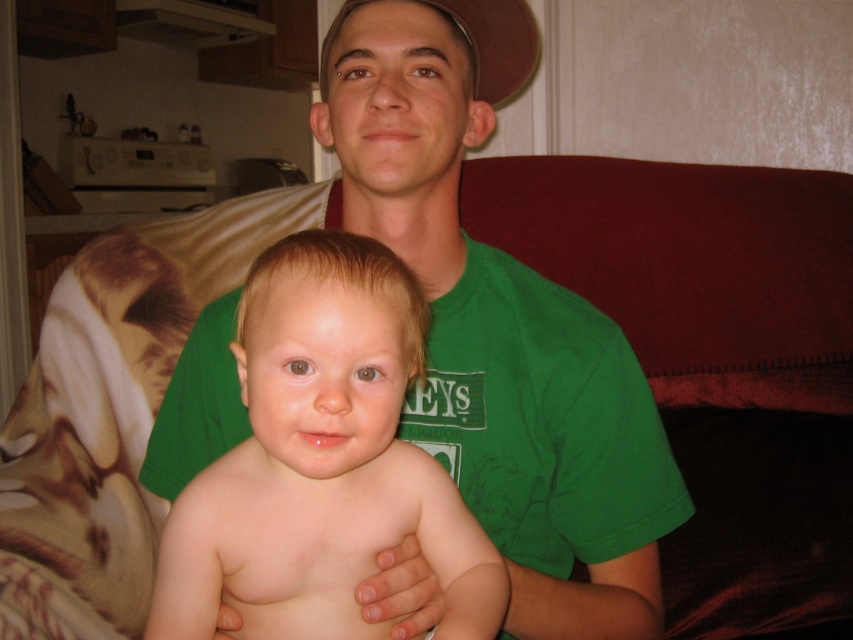
Is green cotton shirt at center wider than smooth skin baby at center?

Yes.

Which is in front, point (572, 580) or point (294, 547)?

Positioned in front is point (294, 547).

Which is in front, point (363, 129) or point (331, 508)?

Point (331, 508) is more forward.

At what (x,y) coordinates should I click in order to perform the action: click on green cotton shirt at center. Please return your answer as a coordinate pair (x, y). The image size is (853, 640). Looking at the image, I should click on (500, 324).

From the picture: Which of these two, green cotton shirt at center or brown fabric baseball hat at upper center, stands shorter?

Standing shorter between the two is brown fabric baseball hat at upper center.

Can you confirm if green cotton shirt at center is thinner than brown fabric baseball hat at upper center?

Incorrect, green cotton shirt at center's width is not less than brown fabric baseball hat at upper center's.

Locate an element on the screen. This screenshot has width=853, height=640. green cotton shirt at center is located at coordinates pos(500,324).

Find the location of a particular element. green cotton shirt at center is located at coordinates (500, 324).

Between smooth skin baby at center and brown fabric baseball hat at upper center, which one has less height?

With less height is brown fabric baseball hat at upper center.

Between smooth skin baby at center and brown fabric baseball hat at upper center, which one is positioned lower?

Positioned lower is smooth skin baby at center.

Describe the element at coordinates (321, 464) in the screenshot. I see `smooth skin baby at center` at that location.

I want to click on smooth skin baby at center, so click(x=321, y=464).